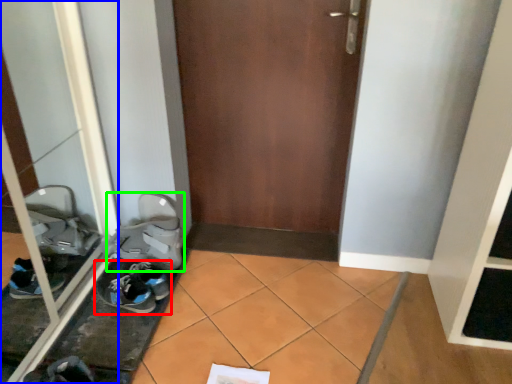
Question: Which object is positioned farthest from footwear (highlighted by a red box)? Select from glass door (highlighted by a blue box) and footwear (highlighted by a green box).

Choices:
 (A) glass door
 (B) footwear

Answer: (A)